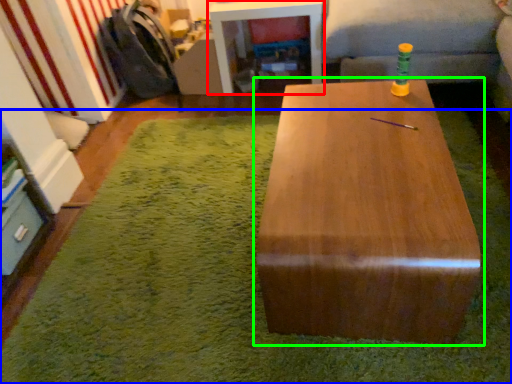
Question: Which is farther away from table (highlighted by a red box)? mat (highlighted by a blue box) or table (highlighted by a green box)?

Choices:
 (A) mat
 (B) table

Answer: (B)